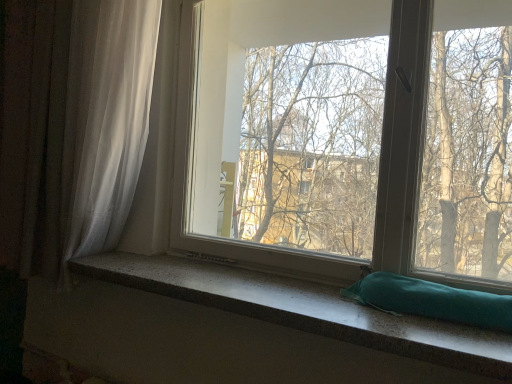
Question: Considering the relative sizes of teal fabric pillow at lower right and granite-like teal pillow at lower center in the image provided, is teal fabric pillow at lower right shorter than granite-like teal pillow at lower center?

Choices:
 (A) no
 (B) yes

Answer: (A)

Question: From a real-world perspective, is teal fabric pillow at lower right below granite-like teal pillow at lower center?

Choices:
 (A) no
 (B) yes

Answer: (A)

Question: Is granite-like teal pillow at lower center at the back of teal fabric pillow at lower right?

Choices:
 (A) no
 (B) yes

Answer: (A)

Question: Is the position of teal fabric pillow at lower right more distant than that of granite-like teal pillow at lower center?

Choices:
 (A) yes
 (B) no

Answer: (A)

Question: Is teal fabric pillow at lower right not near granite-like teal pillow at lower center?

Choices:
 (A) yes
 (B) no

Answer: (B)

Question: From a real-world perspective, relative to granite-like teal pillow at lower center, is white sheer curtain at left vertically above or below?

Choices:
 (A) below
 (B) above

Answer: (B)

Question: Relative to granite-like teal pillow at lower center, is white sheer curtain at left in front or behind?

Choices:
 (A) behind
 (B) front

Answer: (A)

Question: Considering the positions of point (82, 31) and point (372, 312), is point (82, 31) closer or farther from the camera than point (372, 312)?

Choices:
 (A) closer
 (B) farther

Answer: (B)

Question: Looking at the image, does white sheer curtain at left seem bigger or smaller compared to granite-like teal pillow at lower center?

Choices:
 (A) small
 (B) big

Answer: (B)

Question: Considering the positions of granite-like teal pillow at lower center and teal fabric pillow at lower right in the image, is granite-like teal pillow at lower center bigger or smaller than teal fabric pillow at lower right?

Choices:
 (A) small
 (B) big

Answer: (B)

Question: From the image's perspective, is granite-like teal pillow at lower center located above or below teal fabric pillow at lower right?

Choices:
 (A) below
 (B) above

Answer: (A)

Question: Looking at their shapes, would you say granite-like teal pillow at lower center is wider or thinner than teal fabric pillow at lower right?

Choices:
 (A) thin
 (B) wide

Answer: (B)

Question: From a real-world perspective, is granite-like teal pillow at lower center physically located above or below teal fabric pillow at lower right?

Choices:
 (A) below
 (B) above

Answer: (A)

Question: Looking at their shapes, would you say transparent glass window at center is wider or thinner than granite-like teal pillow at lower center?

Choices:
 (A) thin
 (B) wide

Answer: (A)

Question: From a real-world perspective, relative to granite-like teal pillow at lower center, is transparent glass window at center vertically above or below?

Choices:
 (A) below
 (B) above

Answer: (B)